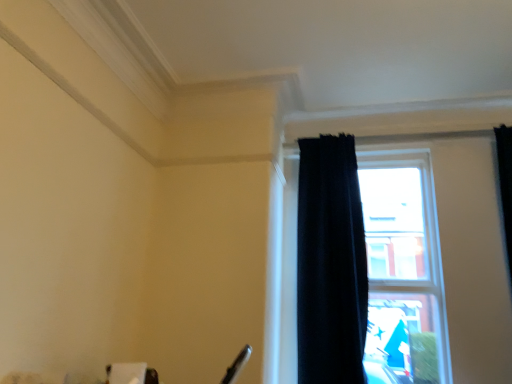
You are a GUI agent. You are given a task and a screenshot of the screen. Output one action in this format:
    pyautogui.click(x=<x>, y=<y>)
    Task: Click on the black velvet curtain at right
    The image size is (512, 384).
    Given the screenshot: What is the action you would take?
    pyautogui.click(x=330, y=264)

The height and width of the screenshot is (384, 512). Describe the element at coordinates (330, 264) in the screenshot. I see `black velvet curtain at right` at that location.

Where is `black curtain at right`? This screenshot has height=384, width=512. black curtain at right is located at coordinates (371, 270).

What is the approximate height of black curtain at right?

1.55 meters.

What is the approximate width of black curtain at right?

The width of black curtain at right is 6.38 inches.

The image size is (512, 384). Describe the element at coordinates (371, 270) in the screenshot. I see `black curtain at right` at that location.

Locate an element on the screen. This screenshot has width=512, height=384. black velvet curtain at right is located at coordinates (330, 264).

From the picture: Which object is positioned more to the left, black curtain at right or black velvet curtain at right?

black velvet curtain at right.

Considering the positions of objects black curtain at right and black velvet curtain at right in the image provided, who is in front, black curtain at right or black velvet curtain at right?

black velvet curtain at right is in front.

Which point is more forward, (435,221) or (324,207)?

The point (435,221) is closer.

From the image's perspective, is black curtain at right below black velvet curtain at right?

Yes, from the image's perspective, black curtain at right is beneath black velvet curtain at right.

From a real-world perspective, who is located higher, black curtain at right or black velvet curtain at right?

In real-world perspective, black velvet curtain at right is above.

Between black curtain at right and black velvet curtain at right, which one has larger width?

Wider between the two is black velvet curtain at right.

In the scene shown: In terms of height, does black curtain at right look taller or shorter compared to black velvet curtain at right?

black curtain at right is shorter than black velvet curtain at right.

Considering the relative sizes of black curtain at right and black velvet curtain at right in the image provided, is black curtain at right bigger than black velvet curtain at right?

Indeed, black curtain at right has a larger size compared to black velvet curtain at right.

Is black velvet curtain at right a part of black curtain at right?

Definitely not — black velvet curtain at right is not inside black curtain at right.

Is there a large distance between black curtain at right and black velvet curtain at right?

No.

Is black velvet curtain at right at the back of black curtain at right?

Correct, black curtain at right is looking away from black velvet curtain at right.

How many degrees apart are the facing directions of black curtain at right and black velvet curtain at right?

0.191 degrees.

The width and height of the screenshot is (512, 384). Identify the location of curtain in front of the black curtain at right. (330, 264).

Can you confirm if black velvet curtain at right is positioned to the left of black curtain at right?

Correct, you'll find black velvet curtain at right to the left of black curtain at right.

Considering their positions, is black velvet curtain at right located in front of or behind black curtain at right?

Clearly, black velvet curtain at right is in front of black curtain at right.

Which point is more distant from viewer, (340, 340) or (423, 190)?

The point (423, 190) is more distant.

From the image's perspective, which object appears higher, black velvet curtain at right or black curtain at right?

black velvet curtain at right is shown above in the image.

From a real-world perspective, is black velvet curtain at right physically above black curtain at right?

Indeed, from a real-world perspective, black velvet curtain at right stands above black curtain at right.

Consider the image. Considering the sizes of objects black velvet curtain at right and black curtain at right in the image provided, who is thinner, black velvet curtain at right or black curtain at right?

black curtain at right is thinner.

Considering the relative sizes of black velvet curtain at right and black curtain at right in the image provided, is black velvet curtain at right shorter than black curtain at right?

In fact, black velvet curtain at right may be taller than black curtain at right.

Is black velvet curtain at right bigger or smaller than black curtain at right?

Considering their sizes, black velvet curtain at right takes up less space than black curtain at right.

Looking at this image, is black velvet curtain at right inside or outside of black curtain at right?

black velvet curtain at right is not enclosed by black curtain at right.

Is there a large distance between black velvet curtain at right and black curtain at right?

No, black velvet curtain at right is not far from black curtain at right.

Could you tell me if black velvet curtain at right is turned towards black curtain at right?

Yes, black velvet curtain at right faces towards black curtain at right.

In the scene shown: How different are the orientations of black velvet curtain at right and black curtain at right in degrees?

The angular difference between black velvet curtain at right and black curtain at right is 0.191 degrees.

How distant is black velvet curtain at right from black curtain at right?

12.34 centimeters.

Image resolution: width=512 pixels, height=384 pixels. Find the location of `window below the black velvet curtain at right (from a real-world perspective)`. window below the black velvet curtain at right (from a real-world perspective) is located at coordinates (371, 270).

Where is `window on the right of black velvet curtain at right`? The height and width of the screenshot is (384, 512). window on the right of black velvet curtain at right is located at coordinates (371, 270).

Find the location of a particular element. This screenshot has height=384, width=512. curtain above the black curtain at right (from a real-world perspective) is located at coordinates (330, 264).